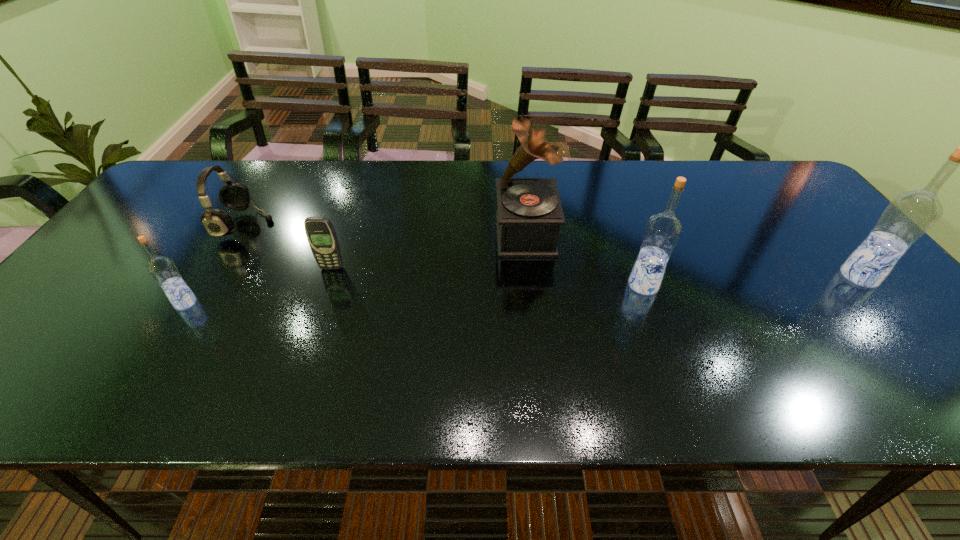
Find the location of `the leftmost vodka`. the leftmost vodka is located at coordinates (162, 269).

Where is `the second shortest vodka`? This screenshot has width=960, height=540. the second shortest vodka is located at coordinates (662, 232).

Find the location of a particular element. the second vodka from left to right is located at coordinates (662, 232).

You are a GUI agent. You are given a task and a screenshot of the screen. Output one action in this format:
    pyautogui.click(x=<x>, y=<y>)
    Task: Click on the rightmost vodka
    This screenshot has height=540, width=960.
    Given the screenshot: What is the action you would take?
    pyautogui.click(x=909, y=215)

You are a GUI agent. You are given a task and a screenshot of the screen. Output one action in this format:
    pyautogui.click(x=<x>, y=<y>)
    Task: Click on the headset
    
    Given the screenshot: What is the action you would take?
    pyautogui.click(x=233, y=195)

What are the coordinates of `the fourth object from left to right` in the screenshot? It's located at (529, 215).

Locate an element on the screen. cellular telephone is located at coordinates (320, 233).

You are a GUI agent. You are given a task and a screenshot of the screen. Output one action in this format:
    pyautogui.click(x=<x>, y=<y>)
    Task: Click on the vacant space located on the right of the leftmost vodka
    This screenshot has width=960, height=540.
    Given the screenshot: What is the action you would take?
    pyautogui.click(x=256, y=303)

You are a GUI agent. You are given a task and a screenshot of the screen. Output one action in this format:
    pyautogui.click(x=<x>, y=<y>)
    Task: Click on the free space located on the front of the second vodka from left to right
    Image resolution: width=960 pixels, height=540 pixels.
    Given the screenshot: What is the action you would take?
    pyautogui.click(x=659, y=326)

The height and width of the screenshot is (540, 960). I want to click on vacant region located 0.100m on the front of the rightmost object, so click(899, 322).